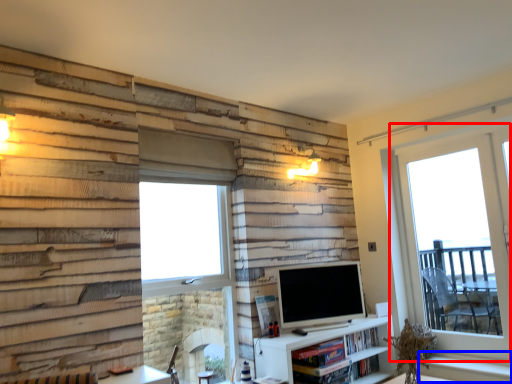
Question: Which point is further to the camera, window (highlighted by a red box) or window sill (highlighted by a blue box)?

Choices:
 (A) window
 (B) window sill

Answer: (A)